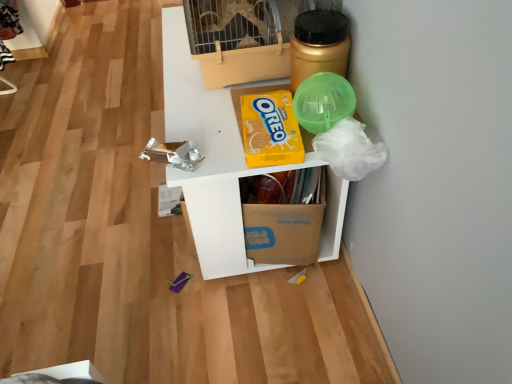
I want to click on free location to the left of white cardboard box at upper center, so click(91, 199).